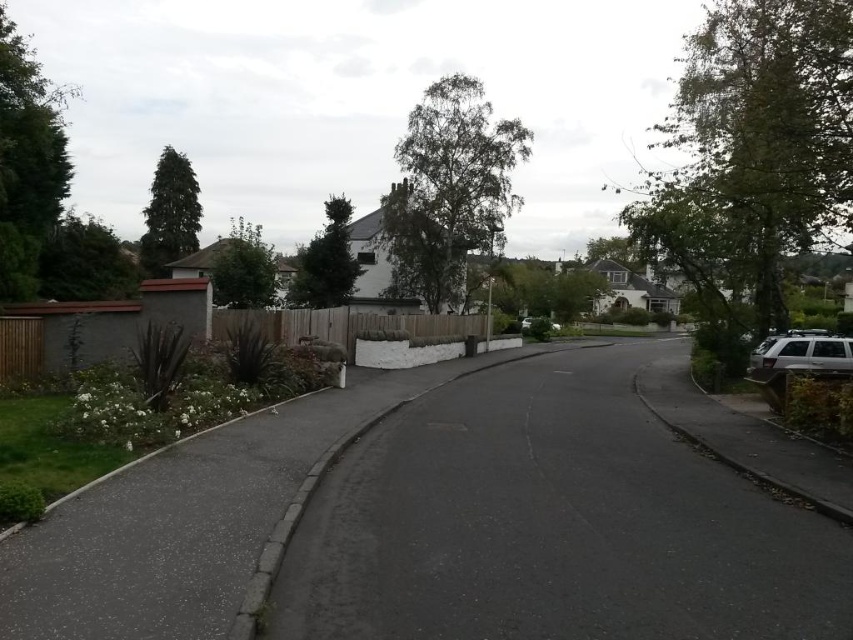
Question: Is green leafy tree at upper left closer to the viewer compared to green matte tree at upper left?

Choices:
 (A) no
 (B) yes

Answer: (B)

Question: Is the position of green leafy tree at upper right less distant than that of green leafy tree at left?

Choices:
 (A) no
 (B) yes

Answer: (B)

Question: Which object is positioned farthest from the green leafy tree at center?

Choices:
 (A) green leafy tree at left
 (B) green matte tree at upper left
 (C) dark green leafy tree at center

Answer: (A)

Question: Observing the image, what is the correct spatial positioning of green leafy tree at upper left in reference to dark green leafy tree at center?

Choices:
 (A) right
 (B) left

Answer: (B)

Question: Which point is closer to the camera?

Choices:
 (A) silver metallic suv at right
 (B) dark green leafy tree at center
 (C) green leafy tree at upper right

Answer: (C)

Question: Which of these objects is positioned closest to the white matte car at center?

Choices:
 (A) green leafy tree at upper right
 (B) green leafy tree at upper left
 (C) green matte tree at upper left

Answer: (C)